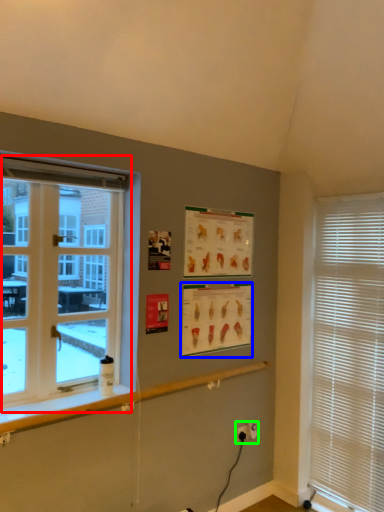
Question: Based on their relative distances, which object is farther from window (highlighted by a red box)? Choose from poster page (highlighted by a blue box) and electric outlet (highlighted by a green box).

Choices:
 (A) poster page
 (B) electric outlet

Answer: (B)